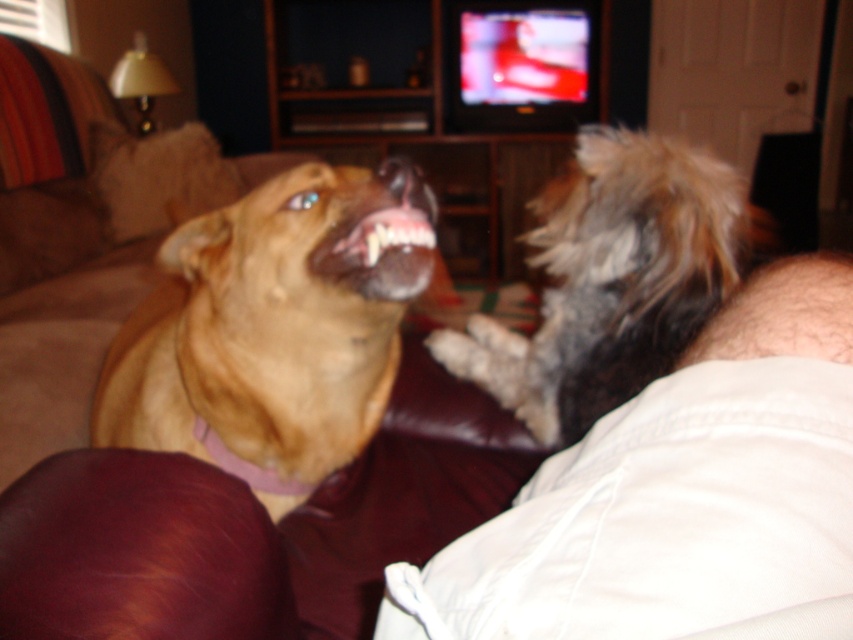
Question: Which object is positioned closest to the brown leather couch at upper left?

Choices:
 (A) matte brown dog at left
 (B) white cotton leg at lower right
 (C) matte brown teeth at center
 (D) fuzzy brown dog at right

Answer: (A)

Question: Does fuzzy brown dog at right appear on the left side of matte brown teeth at center?

Choices:
 (A) no
 (B) yes

Answer: (A)

Question: Which of these objects is positioned closest to the white cotton leg at lower right?

Choices:
 (A) brown leather couch at upper left
 (B) matte brown teeth at center
 (C) fuzzy brown dog at right
 (D) matte brown dog at left

Answer: (B)

Question: Can you confirm if white cotton leg at lower right is positioned below fuzzy brown dog at right?

Choices:
 (A) yes
 (B) no

Answer: (A)

Question: Does brown leather couch at upper left appear under white cotton leg at lower right?

Choices:
 (A) no
 (B) yes

Answer: (A)

Question: Among these points, which one is farthest from the camera?

Choices:
 (A) (338, 573)
 (B) (364, 349)
 (C) (349, 232)

Answer: (A)